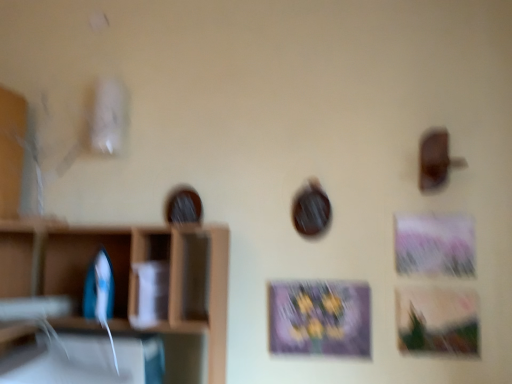
Question: Does matte purple picture frame at center turn towards wooden shelf at left?

Choices:
 (A) yes
 (B) no

Answer: (B)

Question: Is matte purple picture frame at center positioned behind wooden shelf at left?

Choices:
 (A) no
 (B) yes

Answer: (B)

Question: Considering the relative positions of matte purple picture frame at center and wooden shelf at left in the image provided, is matte purple picture frame at center to the left of wooden shelf at left from the viewer's perspective?

Choices:
 (A) yes
 (B) no

Answer: (B)

Question: Is matte purple picture frame at center in front of wooden shelf at left?

Choices:
 (A) no
 (B) yes

Answer: (A)

Question: Would you consider matte purple picture frame at center to be distant from wooden shelf at left?

Choices:
 (A) yes
 (B) no

Answer: (B)

Question: Is wooden shelf at left at the back of matte purple picture frame at center?

Choices:
 (A) yes
 (B) no

Answer: (B)

Question: Can you confirm if wooden shelf at left is bigger than blue plastic iron at left?

Choices:
 (A) yes
 (B) no

Answer: (A)

Question: Could you tell me if wooden shelf at left is facing blue plastic iron at left?

Choices:
 (A) no
 (B) yes

Answer: (A)

Question: From the image's perspective, is wooden shelf at left above blue plastic iron at left?

Choices:
 (A) no
 (B) yes

Answer: (A)

Question: Can you confirm if wooden shelf at left is shorter than blue plastic iron at left?

Choices:
 (A) yes
 (B) no

Answer: (B)

Question: Considering the relative sizes of wooden shelf at left and blue plastic iron at left in the image provided, is wooden shelf at left thinner than blue plastic iron at left?

Choices:
 (A) yes
 (B) no

Answer: (B)

Question: Is wooden shelf at left not inside blue plastic iron at left?

Choices:
 (A) no
 (B) yes

Answer: (B)

Question: Would you say blue plastic iron at left is a long distance from wooden shelf at left?

Choices:
 (A) yes
 (B) no

Answer: (B)